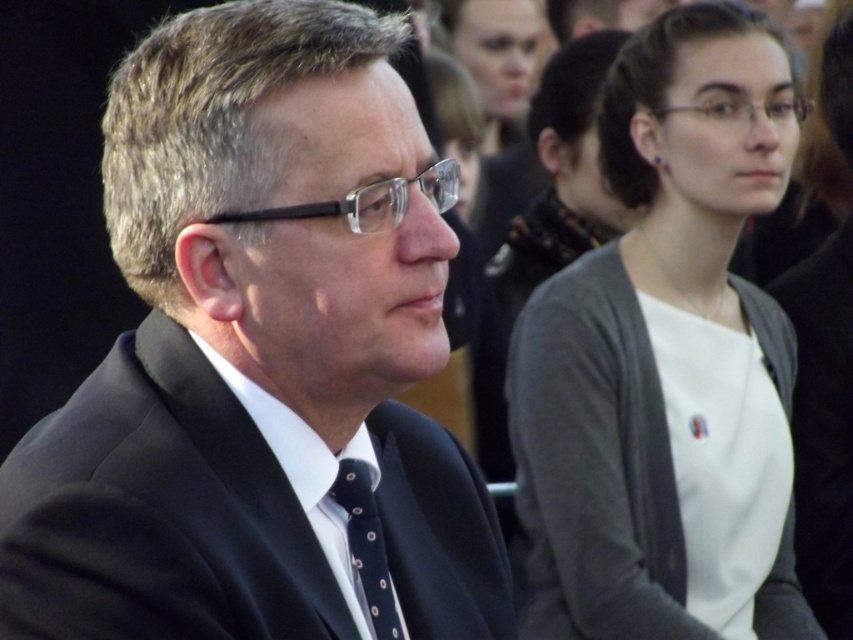
Question: Estimate the real-world distances between objects in this image. Which object is farther from the black suit at left?

Choices:
 (A) dark blue textured tie at center
 (B) white matte shirt at upper right

Answer: (B)

Question: Considering the real-world distances, which object is farthest from the dark blue textured tie at center?

Choices:
 (A) black suit at left
 (B) white matte shirt at upper right

Answer: (B)

Question: Can you confirm if white matte shirt at upper right is thinner than dark blue textured tie at center?

Choices:
 (A) yes
 (B) no

Answer: (B)

Question: Is white matte shirt at upper right positioned behind dark blue textured tie at center?

Choices:
 (A) no
 (B) yes

Answer: (B)

Question: In this image, where is black suit at left located relative to white matte shirt at upper right?

Choices:
 (A) above
 (B) below

Answer: (B)

Question: Which object is the farthest from the dark blue textured tie at center?

Choices:
 (A) white matte shirt at upper right
 (B) black suit at left

Answer: (A)